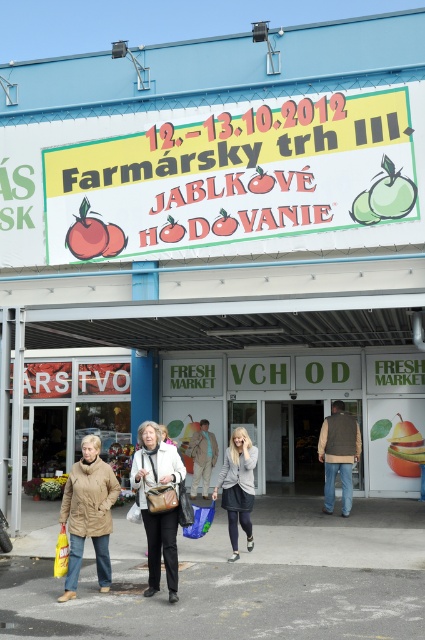
Does leather handbag at center come in front of yellow matte apple at center?

Yes, it is in front of yellow matte apple at center.

Can you confirm if leather handbag at center is thinner than yellow matte apple at center?

Indeed, leather handbag at center has a lesser width compared to yellow matte apple at center.

Identify the location of leather handbag at center. (158, 513).

At what (x,y) coordinates should I click in order to perform the action: click on leather handbag at center. Please return your answer as a coordinate pair (x, y). The image size is (425, 640). Looking at the image, I should click on (158, 513).

Is the position of yellow matte apple at center more distant than that of light brown leather jacket at center?

Yes, yellow matte apple at center is further from the viewer.

Is yellow matte apple at center to the left of light brown leather jacket at center from the viewer's perspective?

Incorrect, yellow matte apple at center is not on the left side of light brown leather jacket at center.

Is point (402, 444) in front of point (203, 484)?

Yes, it is in front of point (203, 484).

The height and width of the screenshot is (640, 425). Find the location of `yellow matte apple at center`. yellow matte apple at center is located at coordinates (405, 449).

Is point (79, 516) closer to viewer compared to point (146, 467)?

No, (79, 516) is behind (146, 467).

Between beige wool coat at center and leather handbag at center, which one appears on the right side from the viewer's perspective?

leather handbag at center

Does point (110, 492) lie behind point (158, 440)?

Yes, point (110, 492) is behind point (158, 440).

Identify the location of beige wool coat at center. (88, 513).